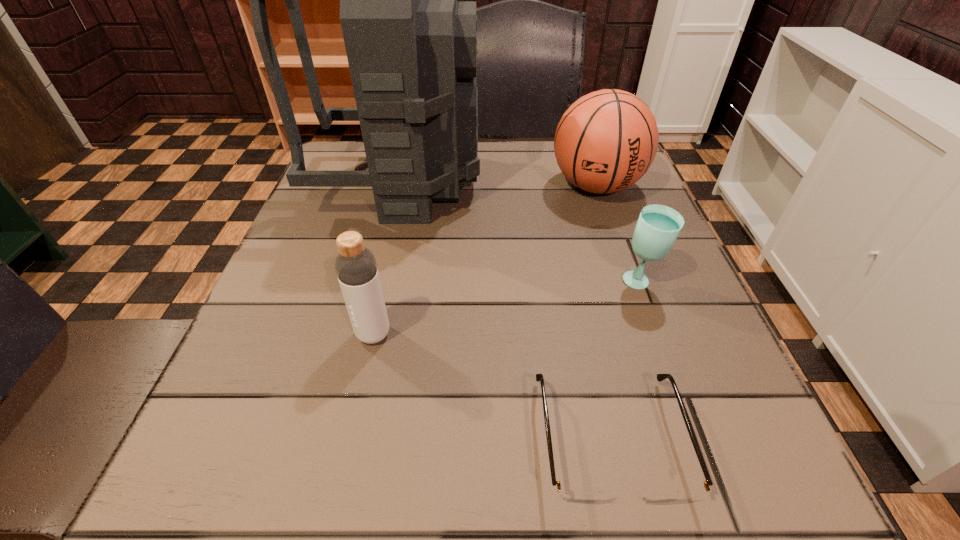
Identify the location of object positioned at the near right corner. (575, 495).

Locate an element on the screen. The width and height of the screenshot is (960, 540). free space at the far edge is located at coordinates (521, 145).

At what (x,y) coordinates should I click in order to perform the action: click on vacant area at the near edge of the desktop. Please return your answer as a coordinate pair (x, y). Looking at the image, I should click on (320, 470).

Locate an element on the screen. The width and height of the screenshot is (960, 540). vacant space at the left edge is located at coordinates (203, 441).

In the image, there is a desktop. Identify the location of free space at the right edge. (591, 198).

In the image, there is a desktop. Where is `vacant area at the near right corner`? This screenshot has width=960, height=540. vacant area at the near right corner is located at coordinates (775, 490).

Find the location of a particular element. This screenshot has width=960, height=540. free spot between the spectacles and the bottle is located at coordinates (492, 387).

Find the location of a particular element. This screenshot has width=960, height=540. empty location between the spectacles and the bottle is located at coordinates (492, 387).

Locate an element on the screen. free spot between the glass and the basketball is located at coordinates (618, 234).

The image size is (960, 540). What are the coordinates of `free area in between the backpack and the basketball` in the screenshot? It's located at (498, 185).